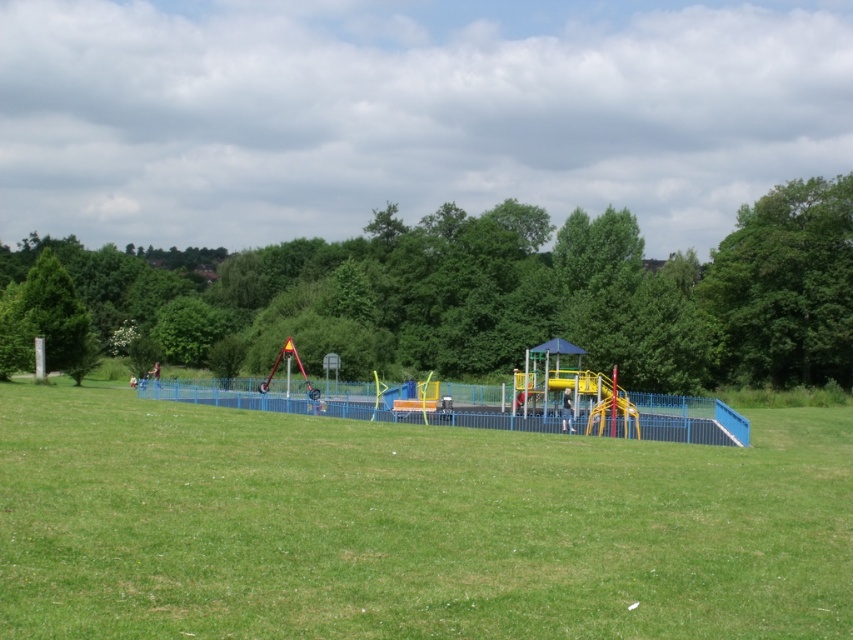
Is green grassy field at center above green leafy tree at left?

Incorrect, green grassy field at center is not positioned above green leafy tree at left.

Is green grassy field at center shorter than green leafy tree at left?

Indeed, green grassy field at center has a lesser height compared to green leafy tree at left.

Is point (45, 445) behind point (15, 294)?

No.

The width and height of the screenshot is (853, 640). I want to click on green grassy field at center, so click(410, 525).

Can you confirm if green grassy field at center is positioned above metallic blue playground at center?

No.

Is green grassy field at center to the left of metallic blue playground at center from the viewer's perspective?

Indeed, green grassy field at center is positioned on the left side of metallic blue playground at center.

Between point (846, 616) and point (694, 426), which one is positioned behind?

The point (694, 426) is behind.

This screenshot has height=640, width=853. In order to click on green grassy field at center in this screenshot , I will do `click(410, 525)`.

Can you confirm if green grassy field at center is smaller than green leafy tree at center?

Yes.

Is green grassy field at center further to camera compared to green leafy tree at center?

No, green grassy field at center is in front of green leafy tree at center.

Where is `green grassy field at center`? green grassy field at center is located at coordinates (410, 525).

I want to click on green grassy field at center, so click(410, 525).